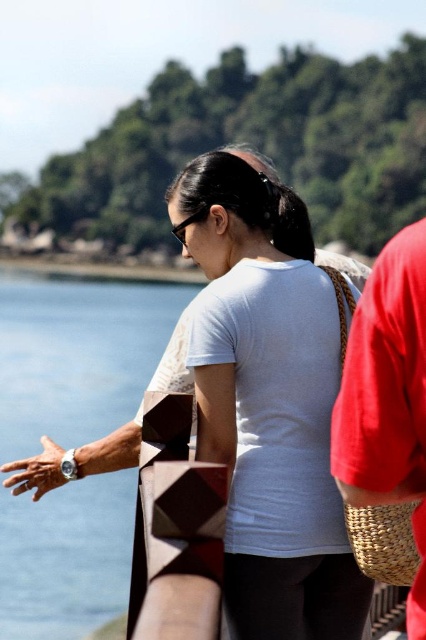
Is point (118, 534) behind point (414, 490)?

Yes, it is behind point (414, 490).

Between point (80, 596) and point (402, 496), which one is positioned in front?

Point (402, 496) is in front.

Find the location of a particular element. The image size is (426, 640). transparent glass water at left is located at coordinates tap(77, 353).

Which is in front, point (275, 529) or point (403, 428)?

Point (403, 428) is in front.

Is point (350, 596) farther from camera compared to point (359, 353)?

Yes, point (350, 596) is behind point (359, 353).

Is point (209, 435) more distant than point (374, 449)?

Yes, point (209, 435) is behind point (374, 449).

Where is `white matte shirt at center`? This screenshot has height=640, width=426. white matte shirt at center is located at coordinates (268, 403).

Between point (238, 625) and point (51, 424), which one is positioned in front?

Point (238, 625) is in front.

Is white matte shirt at center closer to the viewer compared to transparent glass water at left?

Yes, it is in front of transparent glass water at left.

Is point (232, 509) farther from viewer compared to point (3, 513)?

No.

Where is `white matte shirt at center`? The image size is (426, 640). white matte shirt at center is located at coordinates (268, 403).